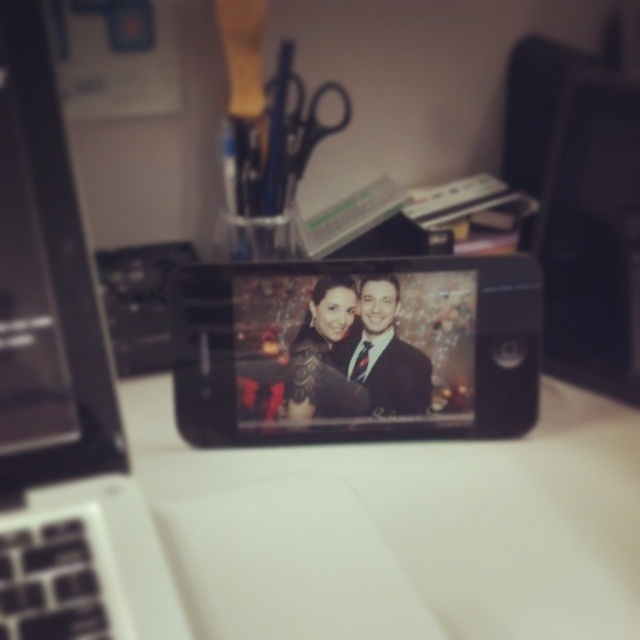
Can you confirm if black plastic laptop at left is positioned to the right of black metallic scissors at upper center?

In fact, black plastic laptop at left is to the left of black metallic scissors at upper center.

Does black plastic laptop at left have a lesser height compared to black metallic scissors at upper center?

→ No.

Describe the element at coordinates (60, 390) in the screenshot. The image size is (640, 640). I see `black plastic laptop at left` at that location.

I want to click on black plastic laptop at left, so click(60, 390).

Does black plastic laptop at left have a larger size compared to matte black suit at center?

Indeed, black plastic laptop at left has a larger size compared to matte black suit at center.

Who is more distant from viewer, (32, 138) or (390, 349)?

Point (390, 349)

Identify the location of black plastic laptop at left. (60, 390).

Is white matte table at center bigger than black plastic laptop at left?

Correct, white matte table at center is larger in size than black plastic laptop at left.

Can you confirm if white matte table at center is positioned above black plastic laptop at left?

Actually, white matte table at center is below black plastic laptop at left.

Describe the element at coordinates (401, 528) in the screenshot. The width and height of the screenshot is (640, 640). I see `white matte table at center` at that location.

Locate an element on the screen. Image resolution: width=640 pixels, height=640 pixels. white matte table at center is located at coordinates (401, 528).